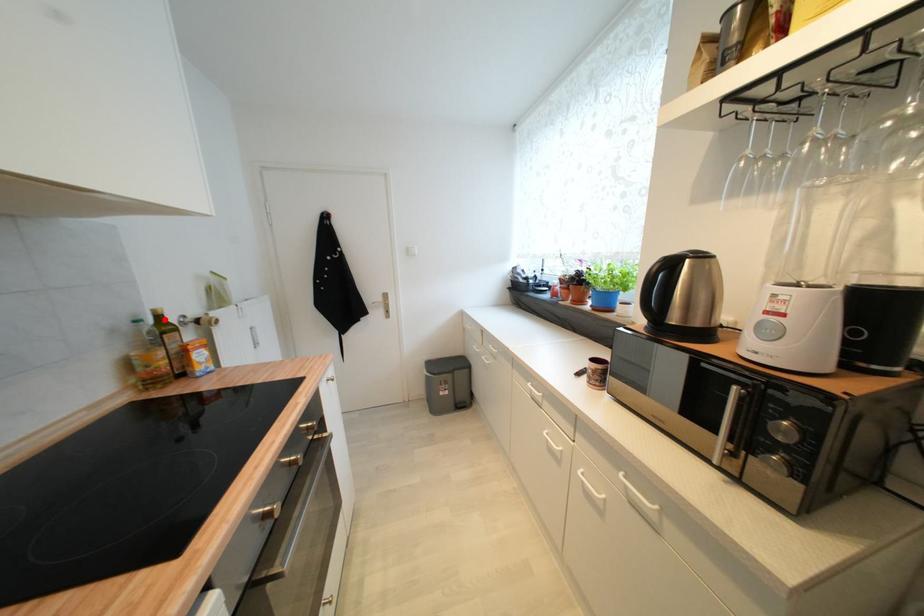
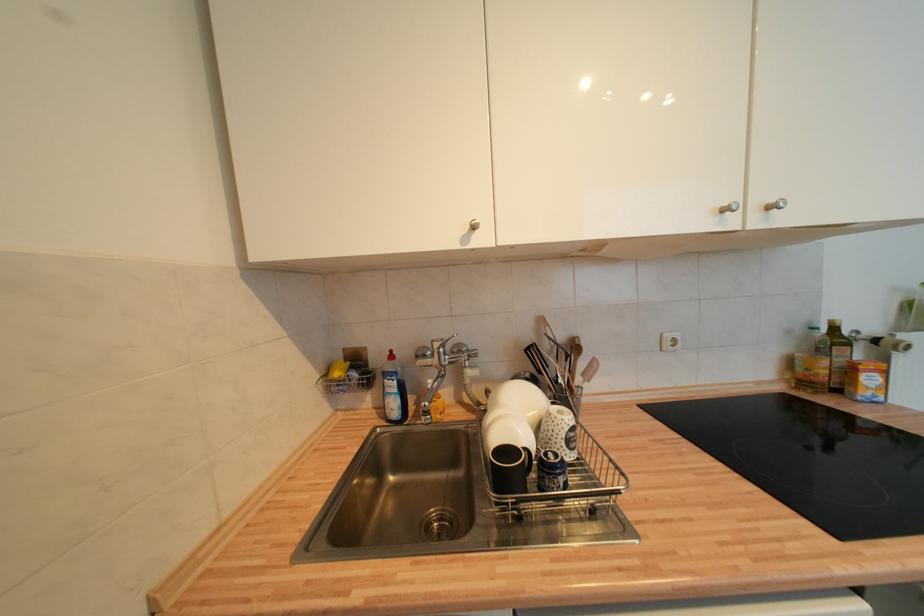
Find the pixel in the second image that matches the highlighted location in the first image.

(840, 331)